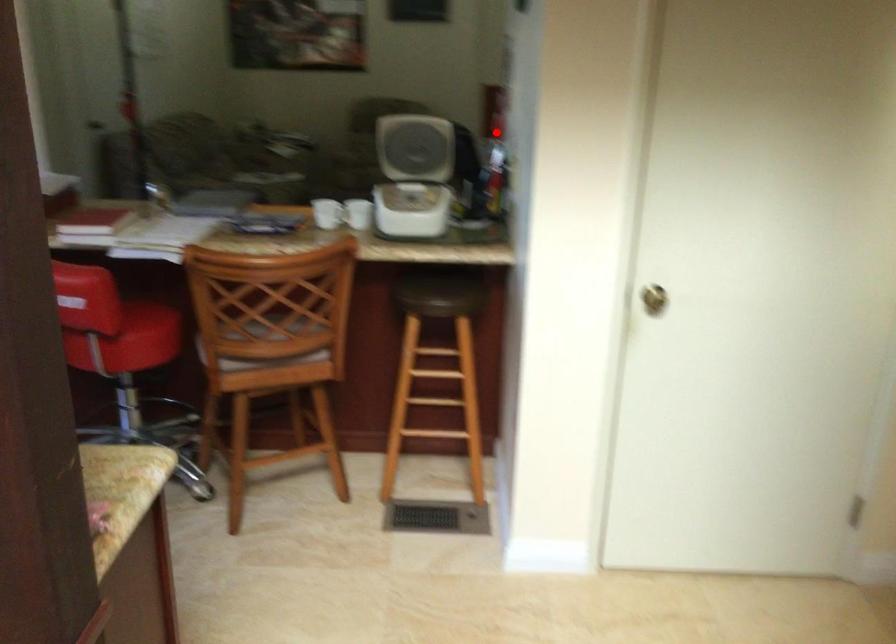
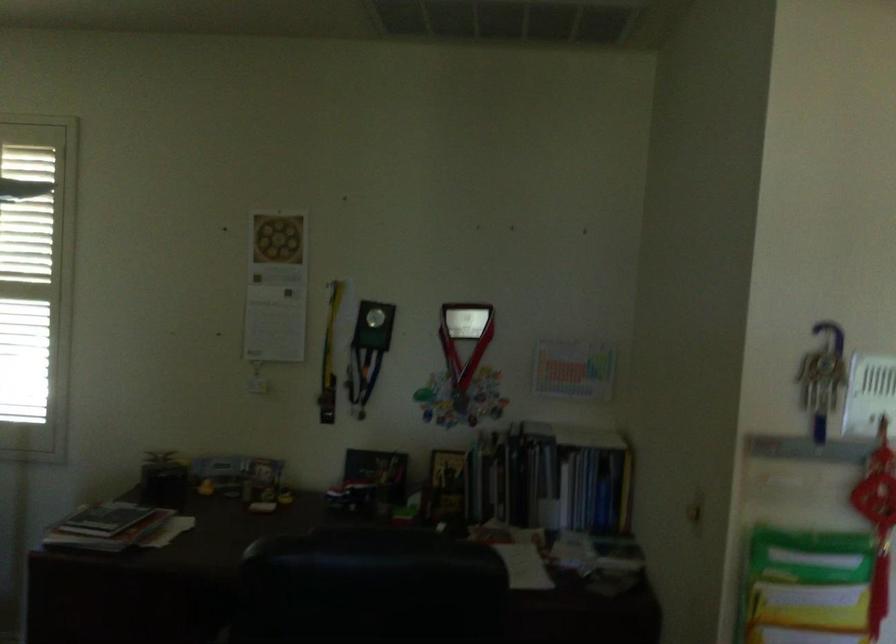
Question: I am providing you with two images of the same scene from different viewpoints. Given a red point in image1, look at the same physical point in image2. Is it:

Choices:
 (A) Closer to the viewpoint
 (B) Farther from the viewpoint

Answer: (A)